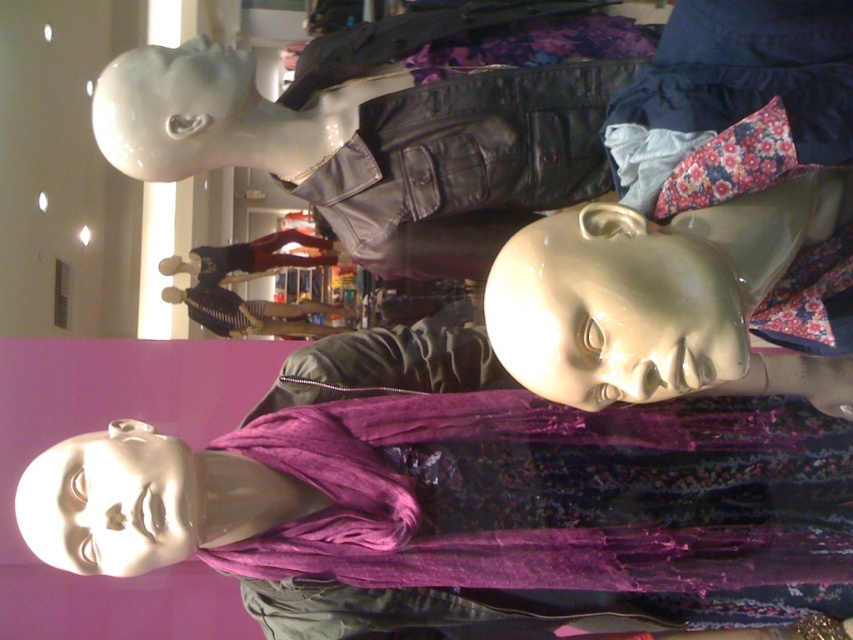
Between glossy plastic head at center and matte white face at center, which one has more height?

glossy plastic head at center

Which is behind, point (704, 211) or point (82, 449)?

Point (82, 449)

Who is more forward, (x=549, y=225) or (x=62, y=515)?

Point (x=549, y=225) is in front.

Where is `glossy plastic head at center`? Image resolution: width=853 pixels, height=640 pixels. glossy plastic head at center is located at coordinates (616, 308).

Does glossy plastic head at center have a smaller size compared to glossy white head at upper center?

No.

Is glossy plastic head at center below glossy white head at upper center?

Correct, glossy plastic head at center is located below glossy white head at upper center.

Find the location of a particular element. The height and width of the screenshot is (640, 853). glossy plastic head at center is located at coordinates (616, 308).

Locate an element on the screen. The image size is (853, 640). glossy plastic head at center is located at coordinates (616, 308).

Can you confirm if matte white face at center is bigger than glossy white head at upper center?

Incorrect, matte white face at center is not larger than glossy white head at upper center.

Between point (172, 545) and point (248, 125), which one is positioned behind?

The point (248, 125) is behind.

Where is `matte white face at center`? matte white face at center is located at coordinates (111, 500).